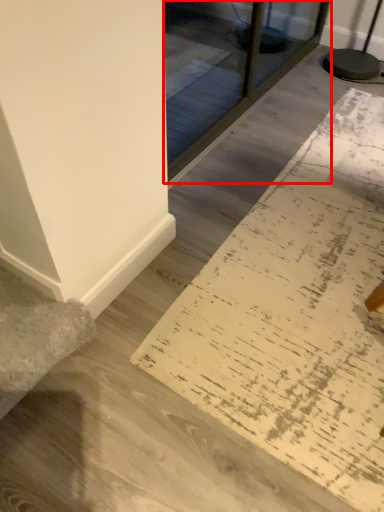
Question: Considering the relative positions of glass door (annotated by the red box) and doormat in the image provided, where is glass door (annotated by the red box) located with respect to the staircase?

Choices:
 (A) left
 (B) right

Answer: (A)